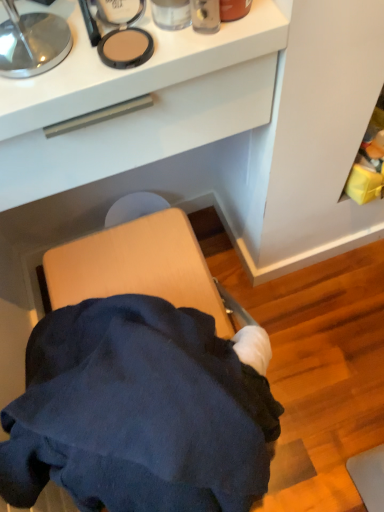
Where is `vacant space that is to the left of matte plastic container at upper center`? Image resolution: width=384 pixels, height=512 pixels. vacant space that is to the left of matte plastic container at upper center is located at coordinates (60, 58).